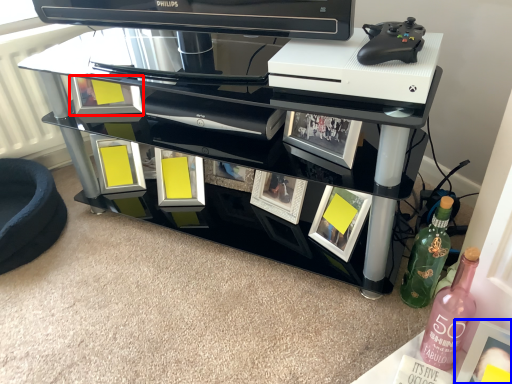
Question: Which object is closer to the camera taking this photo, picture frame (highlighted by a red box) or picture frame (highlighted by a blue box)?

Choices:
 (A) picture frame
 (B) picture frame

Answer: (B)